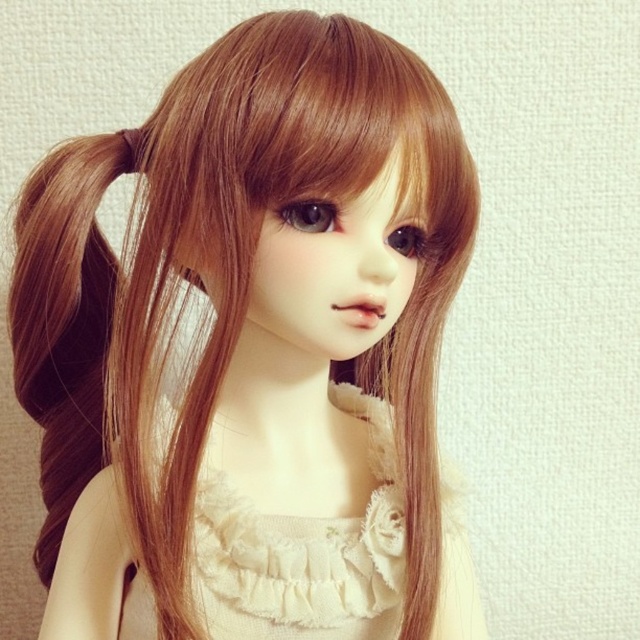
Question: Among these points, which one is nearest to the camera?

Choices:
 (A) (344, 621)
 (B) (67, 259)

Answer: (B)

Question: Is light beige lace dress at center bigger than brown silky hair at left?

Choices:
 (A) yes
 (B) no

Answer: (A)

Question: Observing the image, what is the correct spatial positioning of light beige lace dress at center in reference to brown silky hair at left?

Choices:
 (A) right
 (B) left

Answer: (A)

Question: From the image, what is the correct spatial relationship of light beige lace dress at center in relation to brown silky hair at left?

Choices:
 (A) left
 (B) right

Answer: (B)

Question: Which object is farther from the camera taking this photo?

Choices:
 (A) light beige lace dress at center
 (B) brown silky hair at left

Answer: (B)